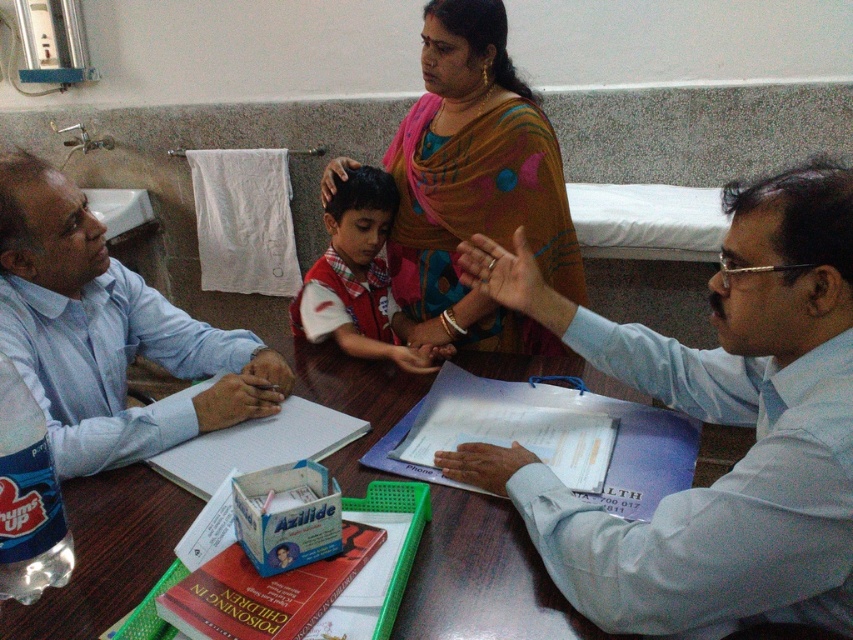
Measure the distance between point (834, 458) and camera.

A distance of 80.86 centimeters exists between point (834, 458) and camera.

Between point (701, 572) and point (154, 404), which one is positioned behind?

The point (154, 404) is more distant.

Between point (526, 467) and point (141, 288), which one is positioned behind?

Positioned behind is point (141, 288).

You are a GUI agent. You are given a task and a screenshot of the screen. Output one action in this format:
    pyautogui.click(x=<x>, y=<y>)
    Task: Click on the light blue shirt at center
    The width and height of the screenshot is (853, 640).
    Given the screenshot: What is the action you would take?
    click(x=711, y=420)

Can you confirm if light blue shirt at center is wider than brown polka dot sari at center?

Incorrect, light blue shirt at center's width does not surpass brown polka dot sari at center's.

Consider the image. Which of these two, light blue shirt at center or brown polka dot sari at center, stands shorter?

With less height is light blue shirt at center.

At what (x,y) coordinates should I click in order to perform the action: click on light blue shirt at center. Please return your answer as a coordinate pair (x, y). Looking at the image, I should click on (711, 420).

Can you confirm if light blue shirt at left is positioned below brown polka dot sari at center?

Indeed, light blue shirt at left is positioned under brown polka dot sari at center.

Locate an element on the screen. light blue shirt at left is located at coordinates (108, 333).

Locate an element on the screen. light blue shirt at left is located at coordinates (108, 333).